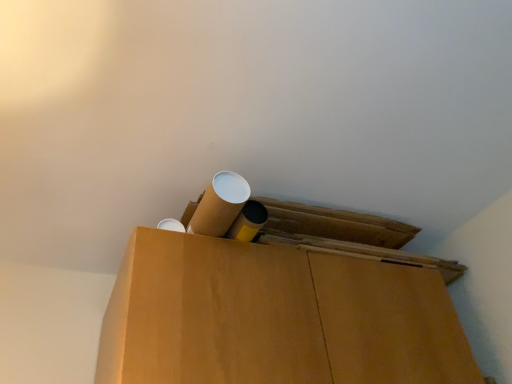
Question: Can you confirm if cardboard tube at upper center, the first wide positioned from the top, is taller than cardboard box at center, which appears as the first wide when ordered from the bottom?

Choices:
 (A) yes
 (B) no

Answer: (B)

Question: Does cardboard tube at upper center, the first wide positioned from the top, have a larger size compared to cardboard box at center, which appears as the first wide when ordered from the bottom?

Choices:
 (A) yes
 (B) no

Answer: (B)

Question: From the image's perspective, is cardboard tube at upper center, the first wide positioned from the top, above cardboard box at center, which appears as the first wide when ordered from the bottom?

Choices:
 (A) yes
 (B) no

Answer: (A)

Question: From a real-world perspective, is cardboard tube at upper center, the first wide positioned from the top, located higher than cardboard box at center, the second wide when ordered from top to bottom?

Choices:
 (A) yes
 (B) no

Answer: (A)

Question: Does cardboard tube at upper center, the first wide positioned from the top, have a greater width compared to cardboard box at center, which appears as the first wide when ordered from the bottom?

Choices:
 (A) yes
 (B) no

Answer: (B)

Question: From a real-world perspective, is cardboard tube at upper center, the first wide positioned from the top, located beneath cardboard box at center, the second wide when ordered from top to bottom?

Choices:
 (A) no
 (B) yes

Answer: (A)

Question: Is cardboard box at center, the second wide when ordered from top to bottom, bigger than cardboard tube at upper center, which appears as the second wide when ordered from the bottom?

Choices:
 (A) yes
 (B) no

Answer: (A)

Question: Considering the relative sizes of cardboard box at center, the second wide when ordered from top to bottom, and cardboard tube at upper center, the first wide positioned from the top, in the image provided, is cardboard box at center, the second wide when ordered from top to bottom, smaller than cardboard tube at upper center, the first wide positioned from the top,?

Choices:
 (A) no
 (B) yes

Answer: (A)

Question: Does cardboard box at center, the second wide when ordered from top to bottom, have a lesser width compared to cardboard tube at upper center, which appears as the second wide when ordered from the bottom?

Choices:
 (A) yes
 (B) no

Answer: (B)

Question: Does cardboard box at center, which appears as the first wide when ordered from the bottom, have a greater width compared to cardboard tube at upper center, which appears as the second wide when ordered from the bottom?

Choices:
 (A) yes
 (B) no

Answer: (A)

Question: Is cardboard box at center, which appears as the first wide when ordered from the bottom, surrounding cardboard tube at upper center, the first wide positioned from the top?

Choices:
 (A) yes
 (B) no

Answer: (B)

Question: Can you confirm if cardboard box at center, the second wide when ordered from top to bottom, is shorter than cardboard tube at upper center, the first wide positioned from the top?

Choices:
 (A) no
 (B) yes

Answer: (A)

Question: In terms of width, does cardboard box at center, which appears as the first wide when ordered from the bottom, look wider or thinner when compared to cardboard tube at upper center, the first wide positioned from the top?

Choices:
 (A) thin
 (B) wide

Answer: (B)